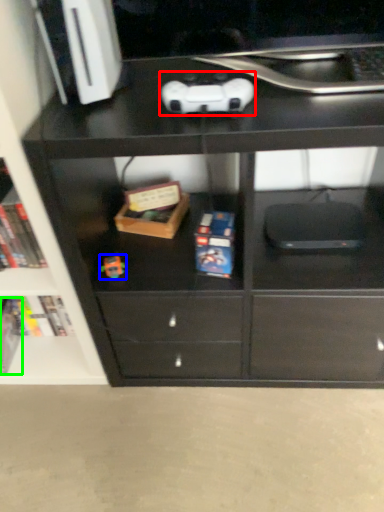
Question: Based on their relative distances, which object is farther from game controller (highlighted by a red box)? Choose from toy (highlighted by a blue box) and paperback book (highlighted by a green box).

Choices:
 (A) toy
 (B) paperback book

Answer: (B)